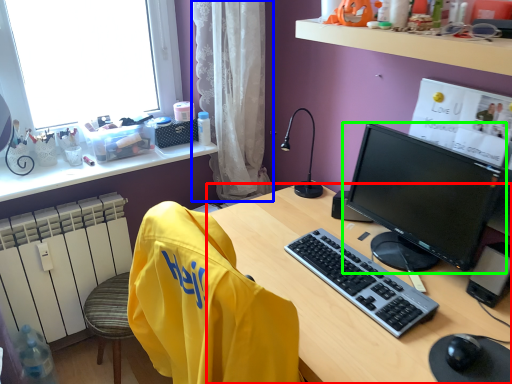
Question: Estimate the real-world distances between objects in this image. Which object is farther from desk (highlighted by a red box), curtain (highlighted by a blue box) or computer monitor (highlighted by a green box)?

Choices:
 (A) curtain
 (B) computer monitor

Answer: (A)